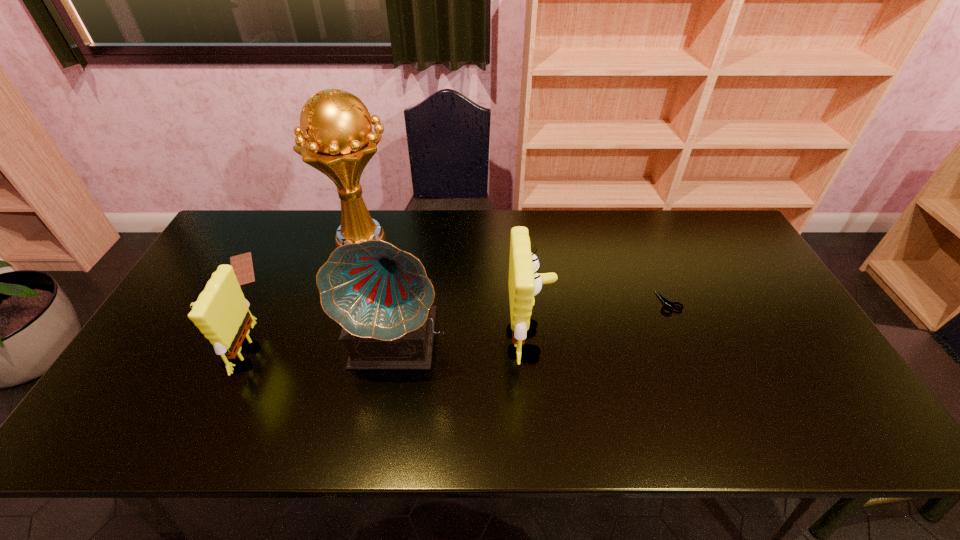
I want to click on record player at the near edge, so click(381, 296).

You are a GUI agent. You are given a task and a screenshot of the screen. Output one action in this format:
    pyautogui.click(x=<x>, y=<y>)
    Task: Click on the object at the left edge
    The image size is (960, 540).
    Given the screenshot: What is the action you would take?
    pyautogui.click(x=242, y=264)

This screenshot has width=960, height=540. Identify the location of object located at the far left corner. (242, 264).

In the image, there is a desktop. Where is `vacant space at the far edge`? vacant space at the far edge is located at coordinates (675, 237).

At what (x,y) coordinates should I click in order to perform the action: click on vacant space at the near edge. Please return your answer as a coordinate pair (x, y). Image resolution: width=960 pixels, height=540 pixels. Looking at the image, I should click on (219, 383).

In the image, there is a desktop. Where is `free space at the far left corner`? Image resolution: width=960 pixels, height=540 pixels. free space at the far left corner is located at coordinates (275, 224).

This screenshot has height=540, width=960. In order to click on free space at the near left corner of the desktop in this screenshot , I will do `click(189, 388)`.

This screenshot has width=960, height=540. Identify the location of blank region between the second object from right to left and the fifth shortest object. (464, 340).

This screenshot has width=960, height=540. Identify the location of free spot between the second object from right to left and the record player. (464, 340).

At what (x,y) coordinates should I click in order to perform the action: click on vacant space that is in between the trophy_cup and the shorter sponge. Please return your answer as a coordinate pair (x, y). The width and height of the screenshot is (960, 540). Looking at the image, I should click on (301, 297).